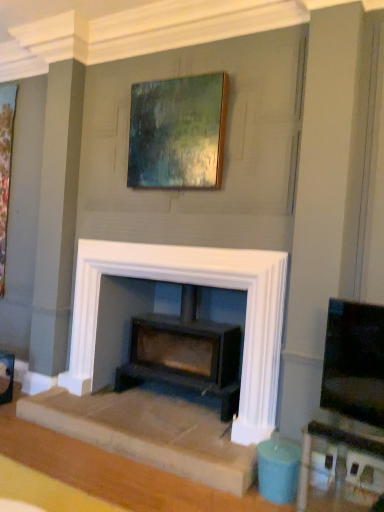
Question: Is matte black tv at right inside the boundaries of wooden frame at upper center, which ranks as the 2th picture frame in left-to-right order, or outside?

Choices:
 (A) outside
 (B) inside

Answer: (A)

Question: From a real-world perspective, relative to wooden frame at upper center, which ranks as the 2th picture frame in left-to-right order, is matte black tv at right vertically above or below?

Choices:
 (A) below
 (B) above

Answer: (A)

Question: Based on their relative distances, which object is nearer to the white stone fireplace at center?

Choices:
 (A) wooden frame at upper center, which is counted as the first picture frame, starting from the front
 (B) wooden picture frame at left, which appears as the second picture frame when viewed from the front
 (C) matte black tv at right
 (D) matte black wood burning stove at center
 (E) matte white table at lower right

Answer: (D)

Question: Which of these objects is positioned closest to the white stone fireplace at center?

Choices:
 (A) matte white table at lower right
 (B) wooden picture frame at left, the first picture frame in the left-to-right sequence
 (C) matte black tv at right
 (D) wooden frame at upper center, the 1th picture frame from the right
 (E) matte black wood burning stove at center

Answer: (E)